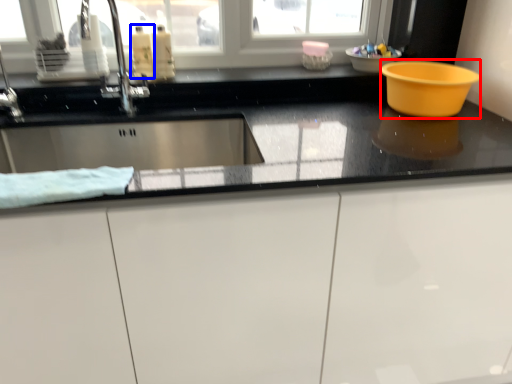
Question: Which object appears farthest to the camera in this image, basin (highlighted by a red box) or liquid (highlighted by a blue box)?

Choices:
 (A) basin
 (B) liquid

Answer: (B)